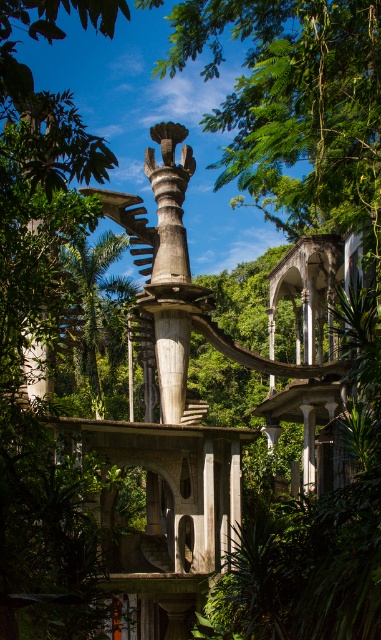
Question: Which object is closer to the camera taking this photo?

Choices:
 (A) wooden sculpture at center
 (B) green leafy tree at center

Answer: (A)

Question: Can you confirm if wooden sculpture at center is positioned above green leafy tree at center?

Choices:
 (A) yes
 (B) no

Answer: (A)

Question: Does wooden sculpture at center appear under green leafy tree at center?

Choices:
 (A) yes
 (B) no

Answer: (B)

Question: Which object is closer to the camera taking this photo?

Choices:
 (A) green leafy tree at center
 (B) wooden sculpture at center

Answer: (B)

Question: Does wooden sculpture at center lie behind green leafy tree at center?

Choices:
 (A) no
 (B) yes

Answer: (A)